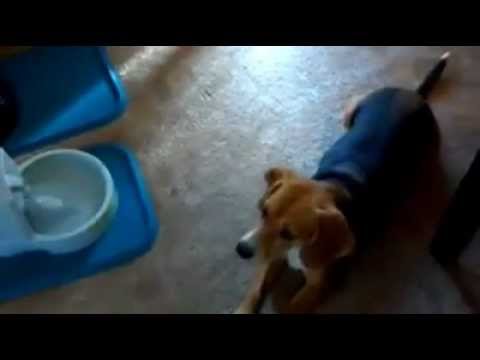
Locate an element on the screen. The height and width of the screenshot is (360, 480). chest is located at coordinates (294, 259).